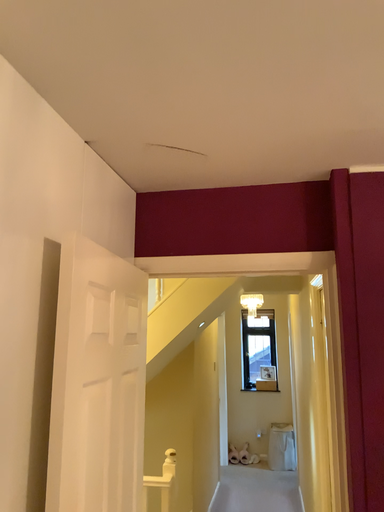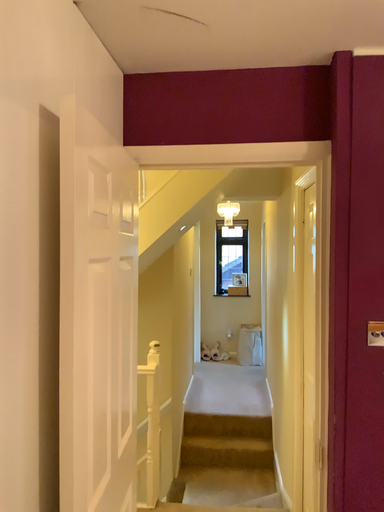
Question: How did the camera likely rotate when shooting the video?

Choices:
 (A) rotated downward
 (B) rotated upward

Answer: (A)